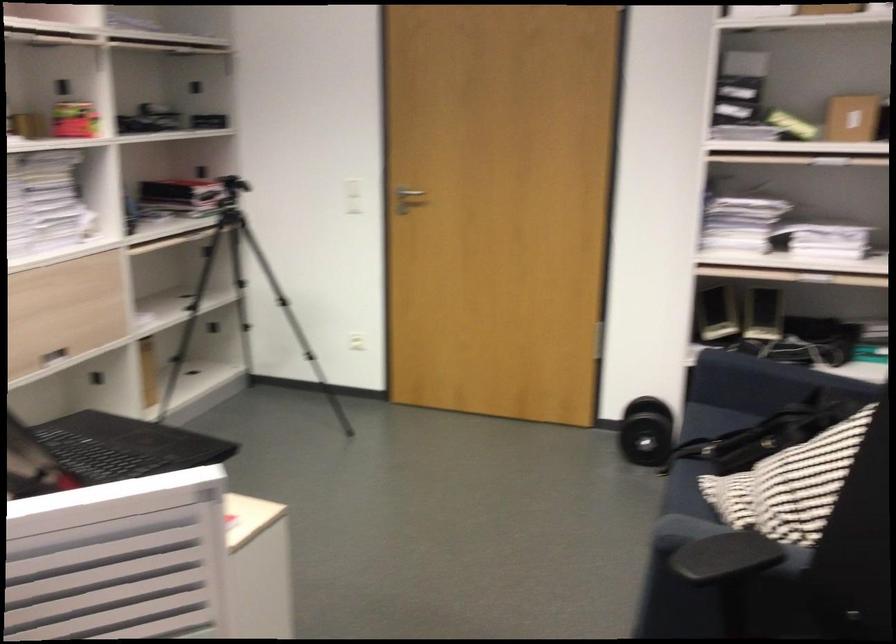
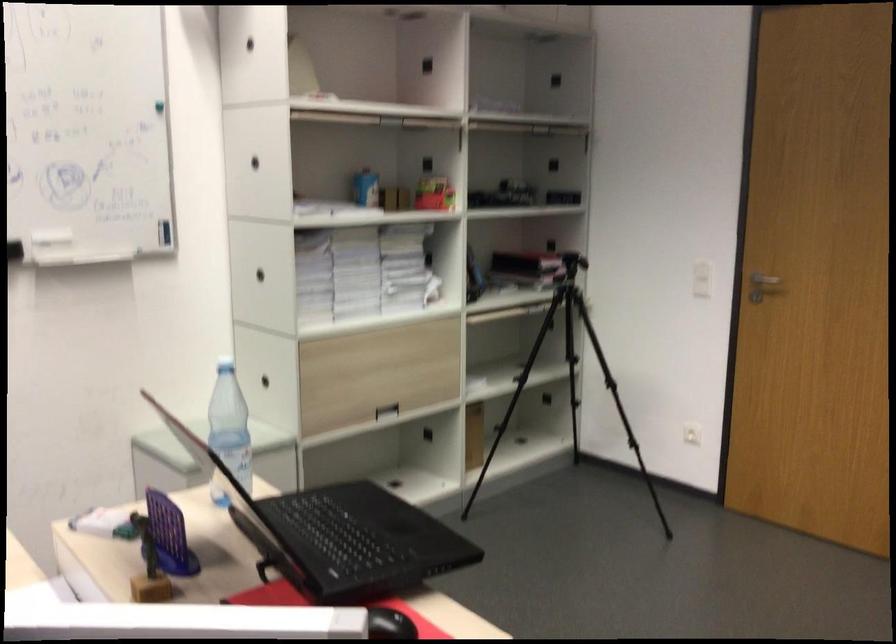
In a continuous first-person perspective shot, in which direction is the camera moving?

The movement direction of the cameraman is right, forward.